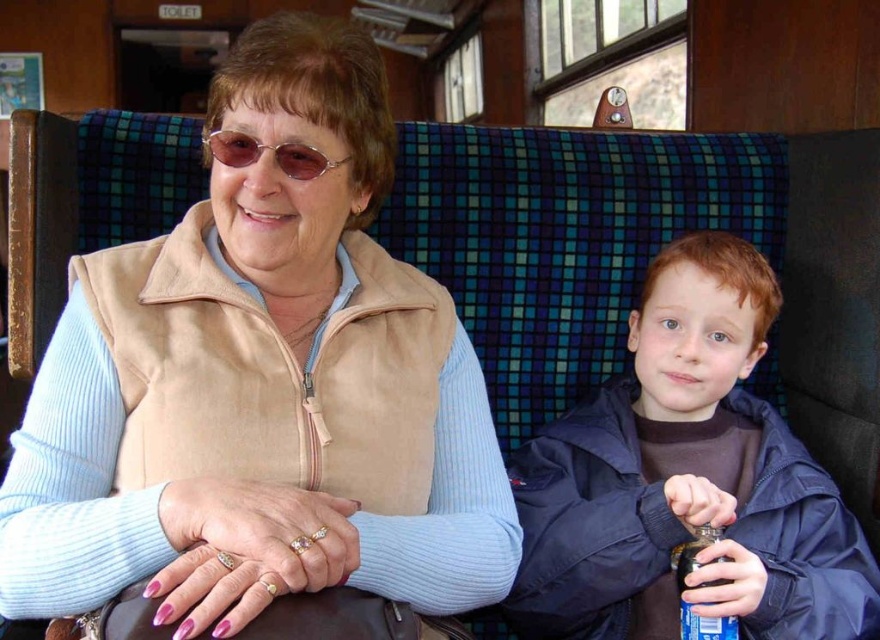
You are a photographer trying to capture a photo of the dark blue jacket at right and the dark glass bottle at lower right. To ensure both are in focus, you need to know which object is taller. Can you tell me which one is taller?

The dark blue jacket at right is taller than the dark glass bottle at lower right according to the description, so you should adjust your camera settings to focus on the taller object first.

You are a passenger on a train and want to place a 1.2 meter wide object between the dark blue jacket at right and the dark glass bottle at lower right. Is there enough space?

The dark blue jacket at right might be wider than the dark glass bottle at lower right, so the space between them may not be sufficient for a 1.2 meter wide object. Check the actual distance before placing it.